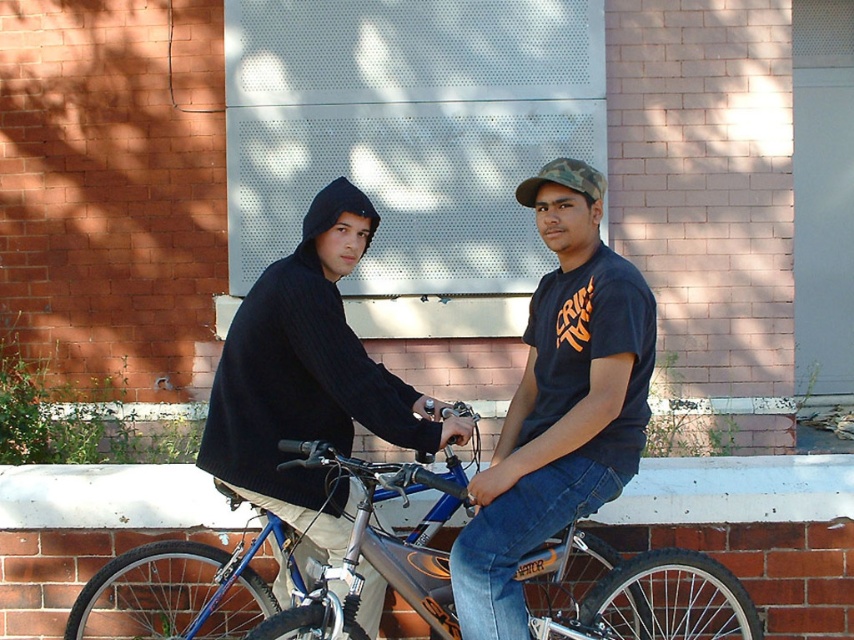
How far apart are blue metallic bicycle at center and white painted brick ledge at lower center?

blue metallic bicycle at center is 49.89 centimeters away from white painted brick ledge at lower center.

Does point (110, 600) come in front of point (79, 465)?

Yes, it is.

Where is `blue metallic bicycle at center`? The width and height of the screenshot is (854, 640). blue metallic bicycle at center is located at coordinates (285, 566).

Does matte black t-shirt at center appear under dark blue knit hoodie at left?

Yes, matte black t-shirt at center is below dark blue knit hoodie at left.

Which is more to the right, matte black t-shirt at center or dark blue knit hoodie at left?

From the viewer's perspective, matte black t-shirt at center appears more on the right side.

Where is `matte black t-shirt at center`? matte black t-shirt at center is located at coordinates (559, 403).

Where is `matte black t-shirt at center`? The image size is (854, 640). matte black t-shirt at center is located at coordinates (559, 403).

Does point (515, 611) lie behind point (136, 483)?

That is False.

In order to click on matte black t-shirt at center in this screenshot , I will do `click(559, 403)`.